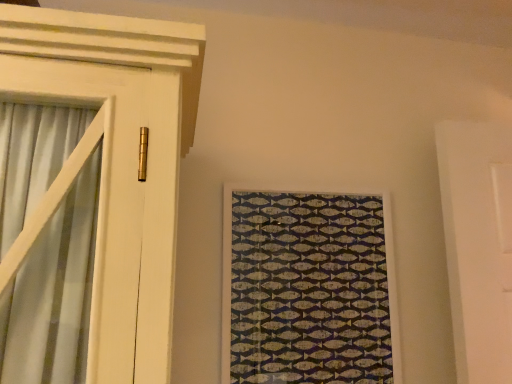
Where is `textured fabric fish-patterned artwork at center`? The height and width of the screenshot is (384, 512). textured fabric fish-patterned artwork at center is located at coordinates (308, 288).

What do you see at coordinates (308, 288) in the screenshot?
I see `textured fabric fish-patterned artwork at center` at bounding box center [308, 288].

Measure the distance between textured fabric fish-patterned artwork at center and camera.

The depth of textured fabric fish-patterned artwork at center is 3.60 feet.

Identify the location of textured fabric fish-patterned artwork at center. (308, 288).